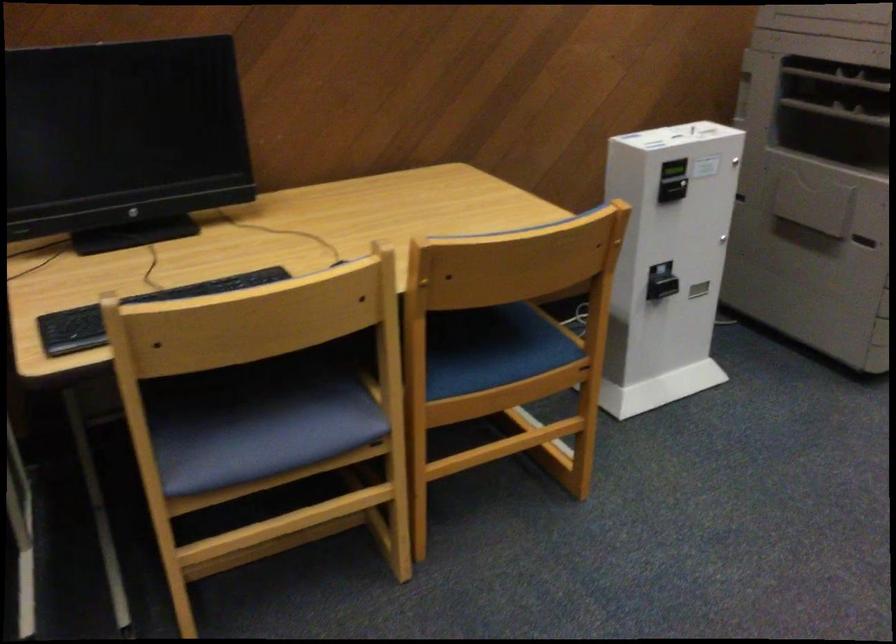
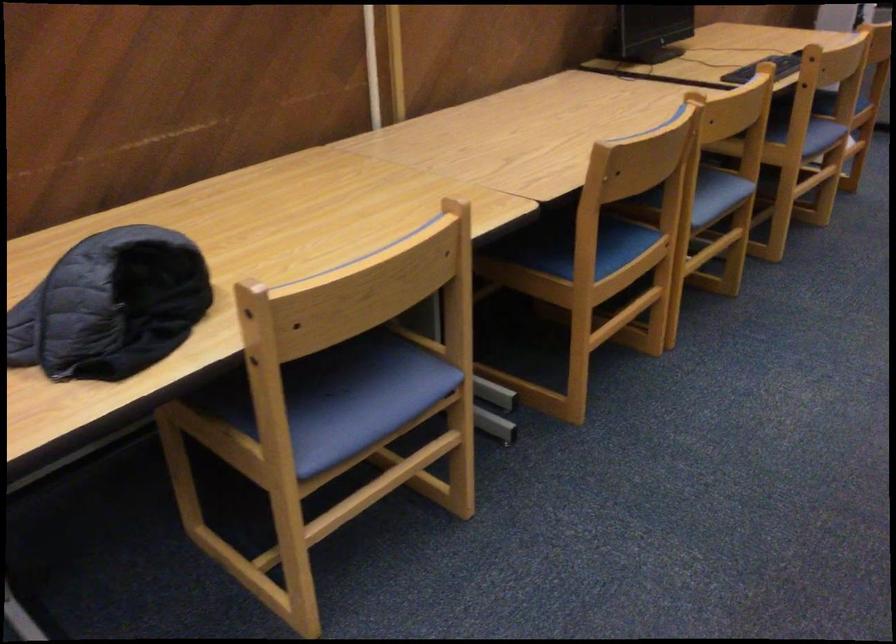
The point at (269, 460) is marked in the first image. Where is the corresponding point in the second image?

(821, 136)